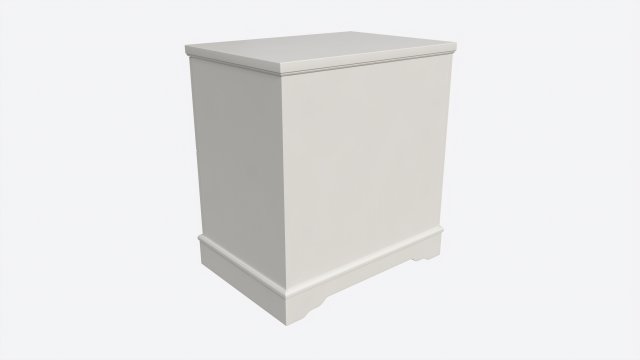
At what (x,y) coordinates should I click in order to perform the action: click on space above furniture. Please return your answer as a coordinate pair (x, y). Looking at the image, I should click on (304, 14).